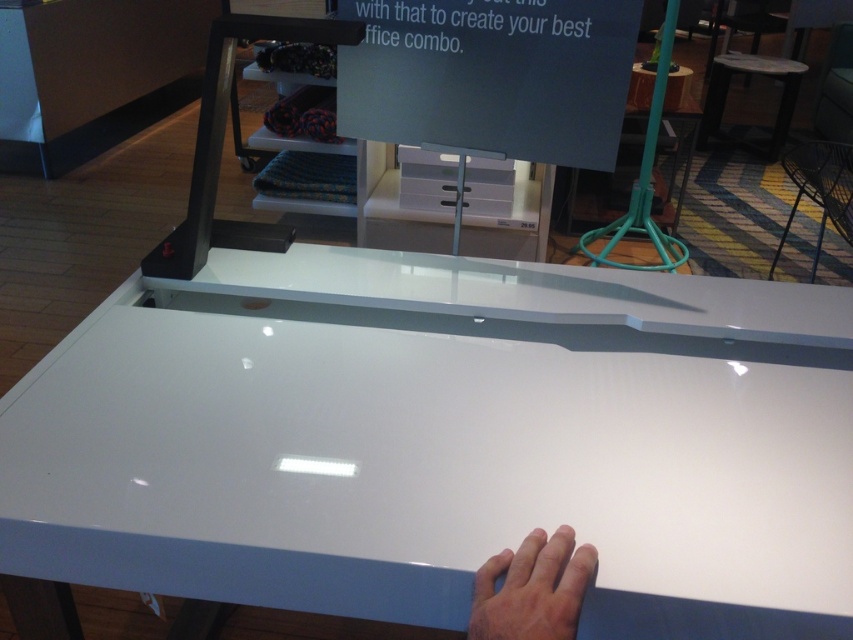
The height and width of the screenshot is (640, 853). Describe the element at coordinates (445, 440) in the screenshot. I see `white glossy table at center` at that location.

You are a GUI agent. You are given a task and a screenshot of the screen. Output one action in this format:
    pyautogui.click(x=<x>, y=<y>)
    Task: Click on the white glossy table at center
    The image size is (853, 640).
    Given the screenshot: What is the action you would take?
    pyautogui.click(x=445, y=440)

What are the coordinates of `white glossy table at center` in the screenshot? It's located at (445, 440).

Is white glossy table at center closer to the viewer compared to skinny white hand at lower center?

No, white glossy table at center is further to the viewer.

Is white glossy table at center bigger than skinny white hand at lower center?

Yes.

Is point (819, 362) farther from viewer compared to point (567, 586)?

Yes.

Identify the location of white glossy table at center. (445, 440).

The width and height of the screenshot is (853, 640). Describe the element at coordinates (532, 588) in the screenshot. I see `skinny white hand at lower center` at that location.

Is skinny white hand at lower center behind white glossy stool at upper right?

No, skinny white hand at lower center is closer to the viewer.

Is point (474, 618) farther from viewer compared to point (747, 60)?

No, (474, 618) is in front of (747, 60).

Where is `skinny white hand at lower center`? Image resolution: width=853 pixels, height=640 pixels. skinny white hand at lower center is located at coordinates (532, 588).